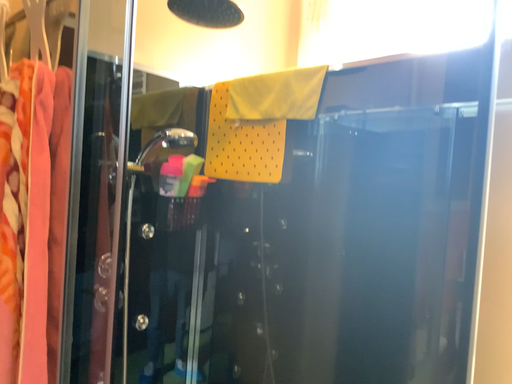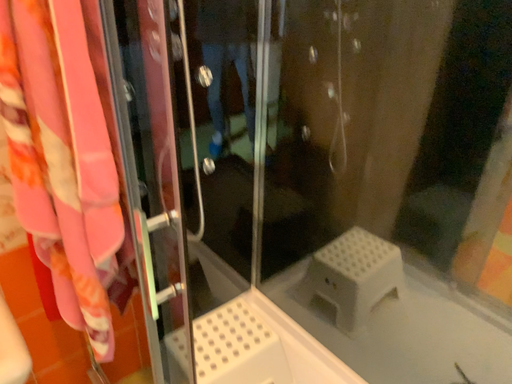
Question: Which way did the camera rotate in the video?

Choices:
 (A) rotated right
 (B) rotated left

Answer: (B)